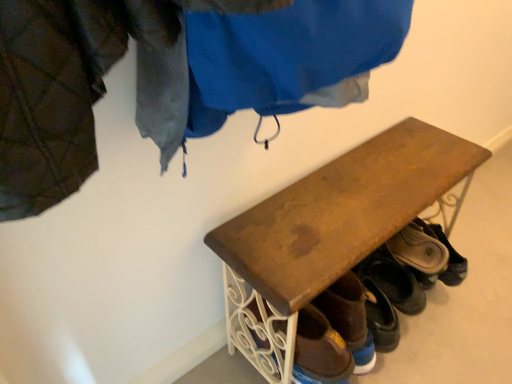
Question: Does brown suede shoe at lower right, arranged as the 1th footwear when viewed from the back, have a smaller size compared to brown leather shoe at lower right, placed as the 2th footwear when sorted from front to back?

Choices:
 (A) yes
 (B) no

Answer: (B)

Question: Considering the relative positions of brown suede shoe at lower right, which is counted as the 3th footwear, starting from the left, and brown leather shoe at lower right, which is the 2th footwear from right to left, in the image provided, is brown suede shoe at lower right, which is counted as the 3th footwear, starting from the left, to the right of brown leather shoe at lower right, which is the 2th footwear from right to left, from the viewer's perspective?

Choices:
 (A) no
 (B) yes

Answer: (B)

Question: Is brown suede shoe at lower right, arranged as the 1th footwear when viewed from the back, closer to camera compared to brown leather shoe at lower right, the second footwear in the left-to-right sequence?

Choices:
 (A) yes
 (B) no

Answer: (B)

Question: Does brown suede shoe at lower right, the 1th footwear viewed from the right, have a greater width compared to brown leather shoe at lower right, the second footwear viewed from the back?

Choices:
 (A) yes
 (B) no

Answer: (A)

Question: Considering the relative sizes of brown suede shoe at lower right, the 1th footwear viewed from the right, and brown leather shoe at lower right, placed as the 2th footwear when sorted from front to back, in the image provided, is brown suede shoe at lower right, the 1th footwear viewed from the right, shorter than brown leather shoe at lower right, placed as the 2th footwear when sorted from front to back,?

Choices:
 (A) yes
 (B) no

Answer: (B)

Question: Considering their positions, is wooden bench at center located in front of or behind brown leather shoe at lower right, the second footwear in the left-to-right sequence?

Choices:
 (A) front
 (B) behind

Answer: (A)

Question: Considering the relative positions of wooden bench at center and brown leather shoe at lower right, the second footwear in the left-to-right sequence, in the image provided, is wooden bench at center to the left or to the right of brown leather shoe at lower right, the second footwear in the left-to-right sequence,?

Choices:
 (A) right
 (B) left

Answer: (B)

Question: Is wooden bench at center bigger or smaller than brown leather shoe at lower right, the second footwear in the left-to-right sequence?

Choices:
 (A) small
 (B) big

Answer: (B)

Question: From the image's perspective, is wooden bench at center located above or below brown leather shoe at lower right, the second footwear viewed from the back?

Choices:
 (A) below
 (B) above

Answer: (A)

Question: From a real-world perspective, relative to wooden bench at center, is brown leather shoe at lower center, arranged as the 3th footwear when viewed from the right, vertically above or below?

Choices:
 (A) above
 (B) below

Answer: (A)

Question: Based on their sizes in the image, would you say brown leather shoe at lower center, placed as the first footwear when sorted from front to back, is bigger or smaller than wooden bench at center?

Choices:
 (A) big
 (B) small

Answer: (B)

Question: In the image, is brown leather shoe at lower center, placed as the first footwear when sorted from front to back, positioned in front of or behind wooden bench at center?

Choices:
 (A) front
 (B) behind

Answer: (B)

Question: Visually, is brown leather shoe at lower center, placed as the first footwear when sorted from front to back, positioned to the left or to the right of wooden bench at center?

Choices:
 (A) left
 (B) right

Answer: (A)

Question: Is brown suede shoe at lower right, which is counted as the 3th footwear, starting from the left, taller or shorter than wooden bench at center?

Choices:
 (A) tall
 (B) short

Answer: (B)

Question: Based on their positions, is brown suede shoe at lower right, the 1th footwear viewed from the right, located to the left or right of wooden bench at center?

Choices:
 (A) right
 (B) left

Answer: (A)